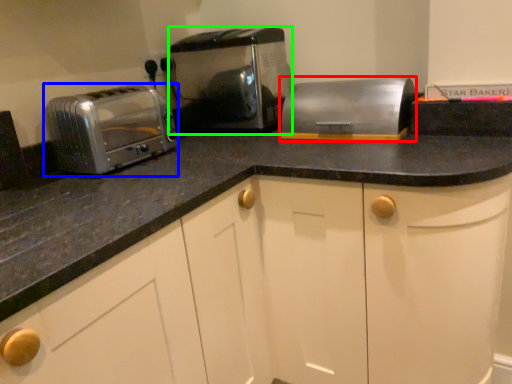
Question: Estimate the real-world distances between objects in this image. Which object is farther from appliance (highlighted by a red box), toaster (highlighted by a blue box) or toaster (highlighted by a green box)?

Choices:
 (A) toaster
 (B) toaster

Answer: (A)